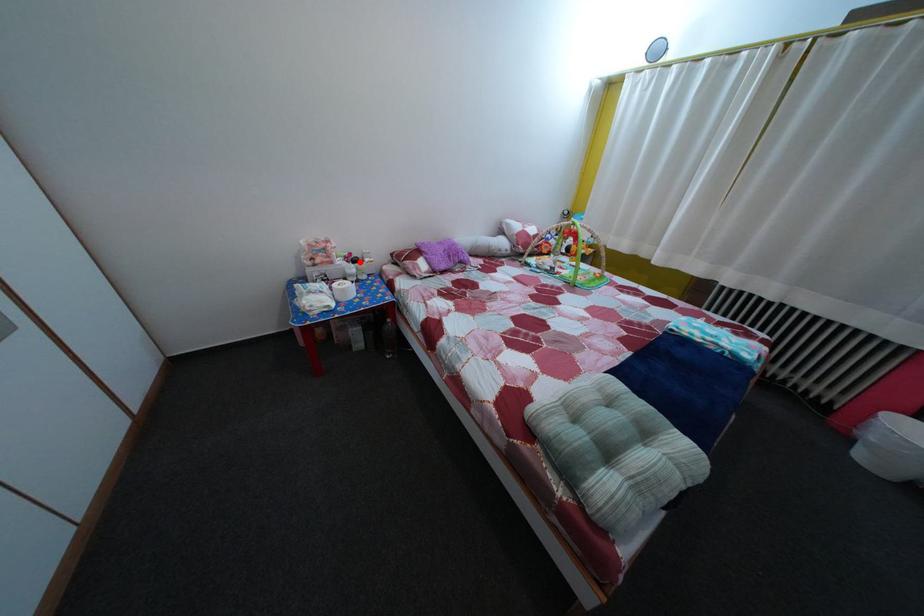
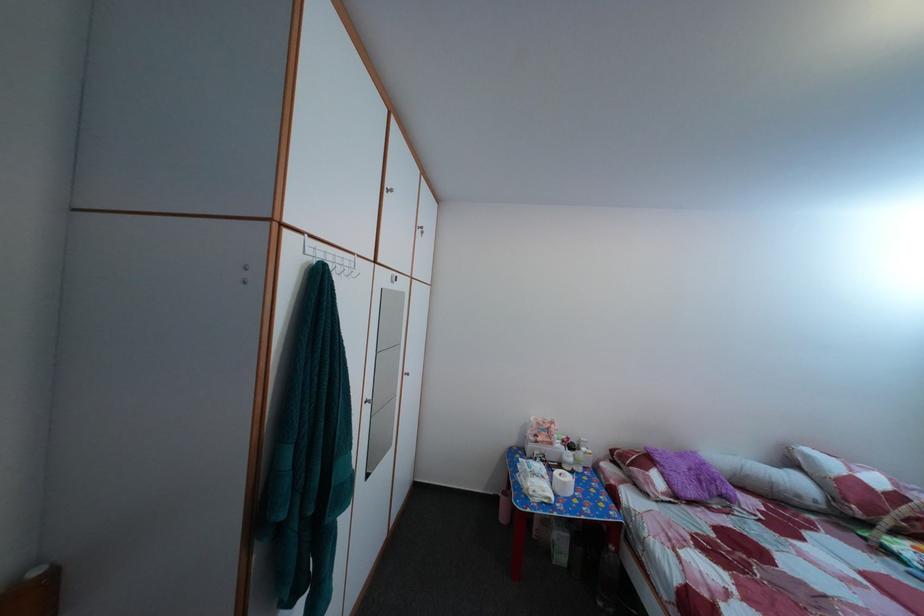
In the second image, find the point that corresponds to the highlighted location in the first image.

(578, 447)